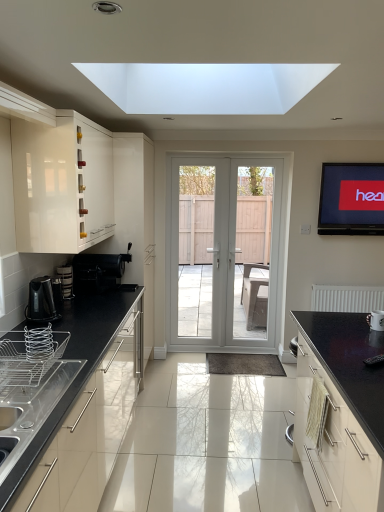
Image resolution: width=384 pixels, height=512 pixels. Identify the location of free space above white matte radiator at right (from a real-world perspective). (352, 281).